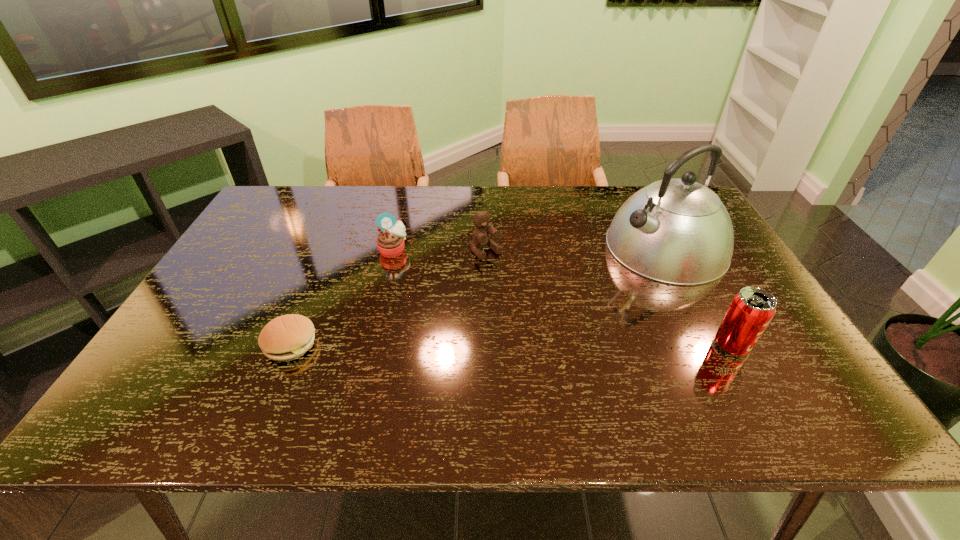
Find the location of a particular element. The image size is (960, 540). object that stands as the second closest to the third object from left to right is located at coordinates (677, 231).

Select which object is the closest to the fourth shortest object. Please provide its 2D coordinates. Your answer should be formatted as a tuple, i.e. [(x, y)], where the tuple contains the x and y coordinates of a point satisfying the conditions above.

[(677, 231)]

What are the coordinates of `vacant position in the image that satisfies the following two spatial constraints: 1. on the front side of the patty; 2. on the left side of the soda can` in the screenshot? It's located at (290, 345).

Locate an element on the screen. The image size is (960, 540). blank space that satisfies the following two spatial constraints: 1. on the front side of the second object from left to right; 2. on the right side of the third object from right to left is located at coordinates (393, 252).